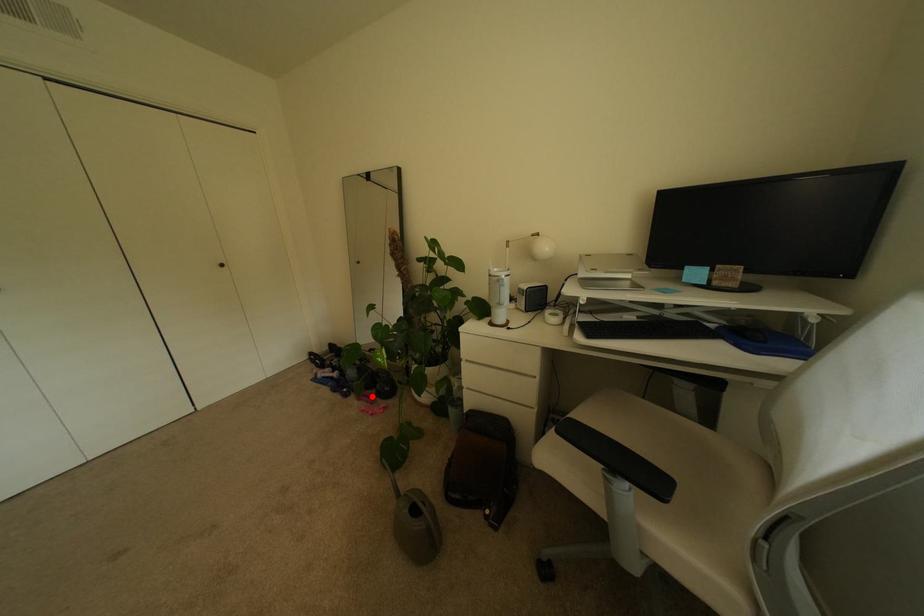
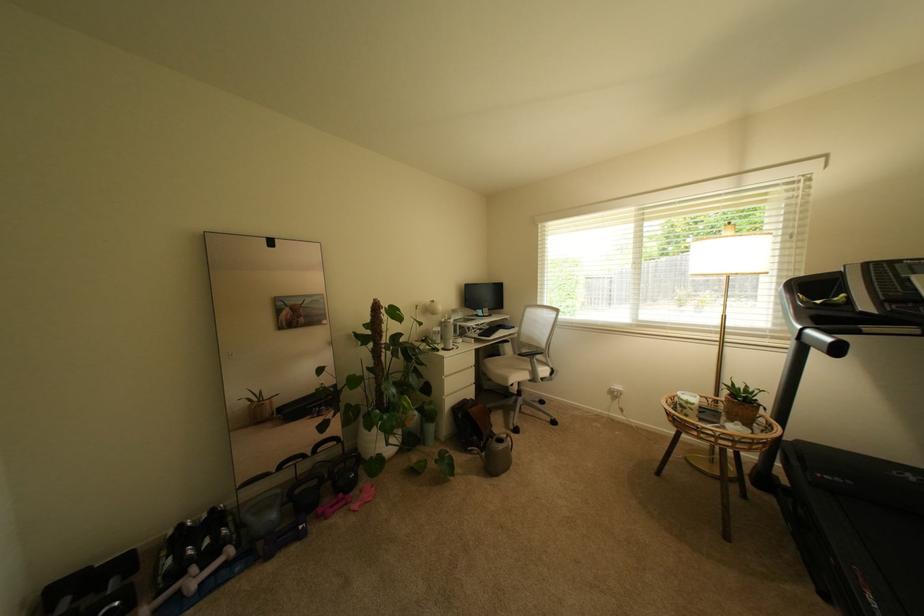
Question: I am providing you with two images of the same scene from different viewpoints. A red point is marked on the first image. Is the red point's position out of view in image 2?

Choices:
 (A) Yes
 (B) No

Answer: (B)